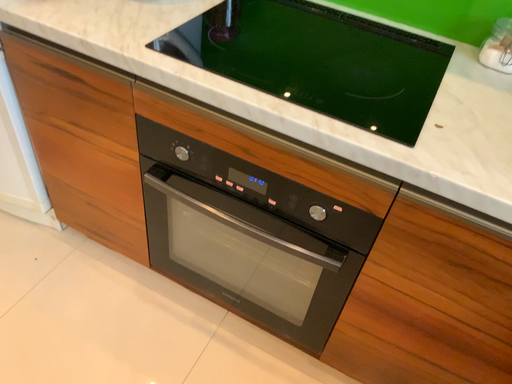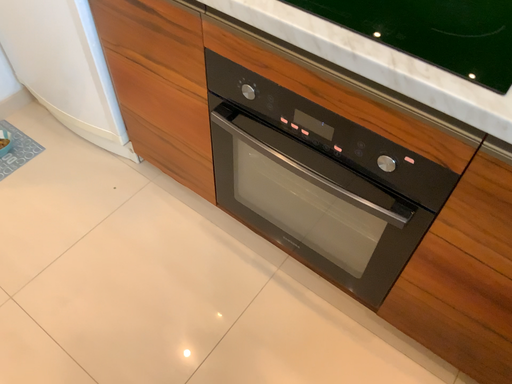
Question: How did the camera likely rotate when shooting the video?

Choices:
 (A) rotated right
 (B) rotated left

Answer: (B)